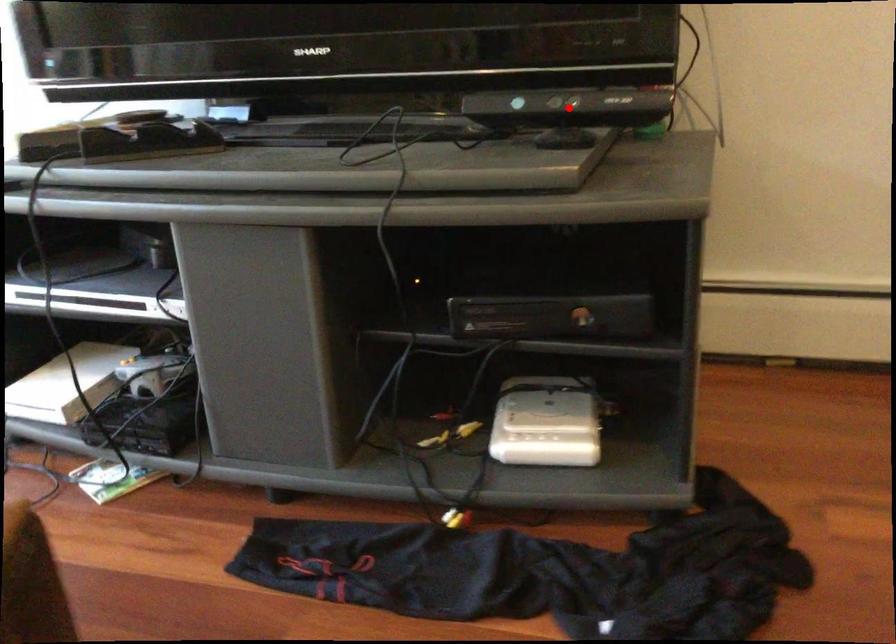
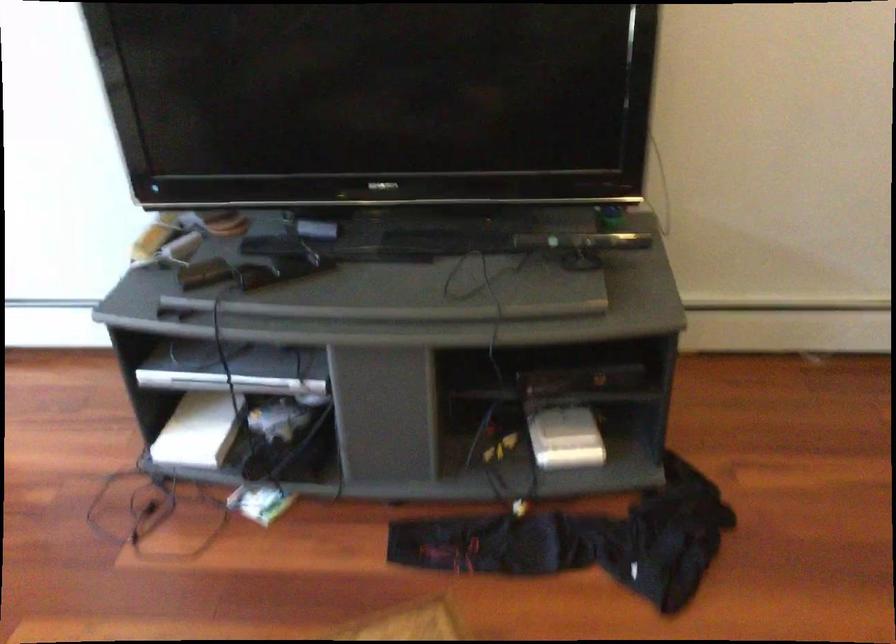
Locate, in the second image, the point that corresponds to the highlighted location in the first image.

(582, 241)